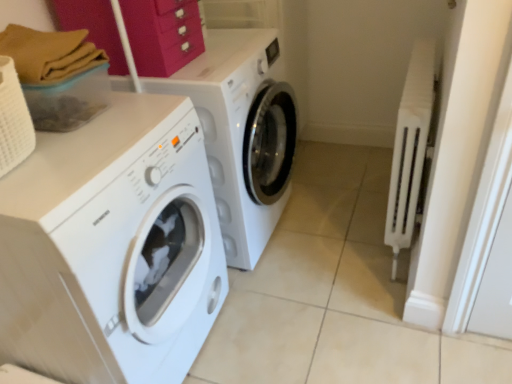
Image resolution: width=512 pixels, height=384 pixels. I want to click on free space in front of white plastic radiator at right, so click(x=385, y=324).